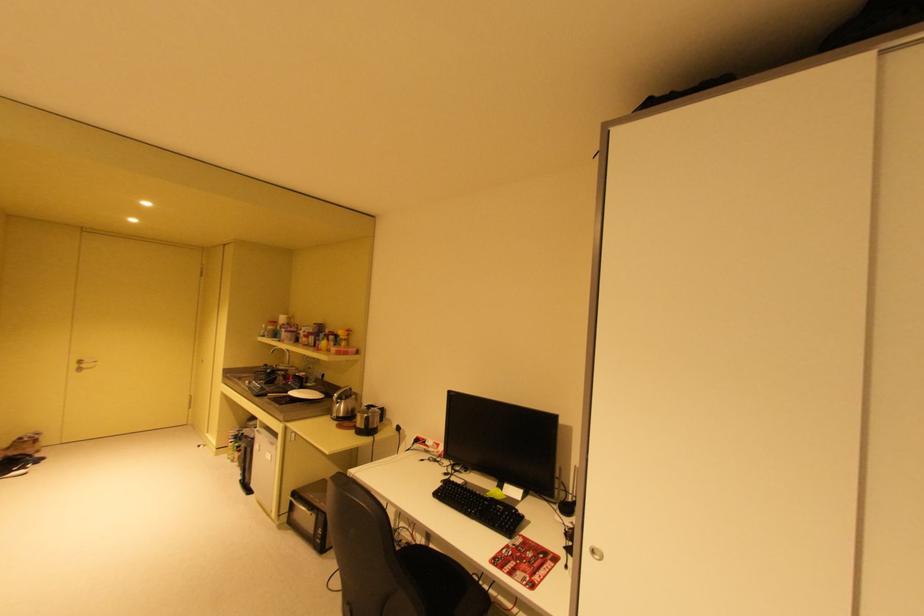
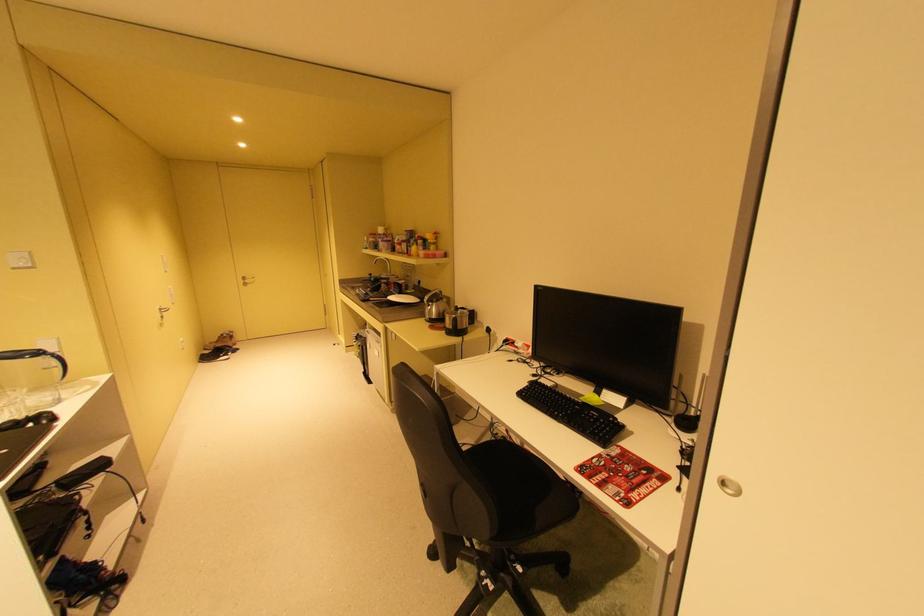
The point at (371, 427) is marked in the first image. Where is the corresponding point in the second image?

(460, 328)